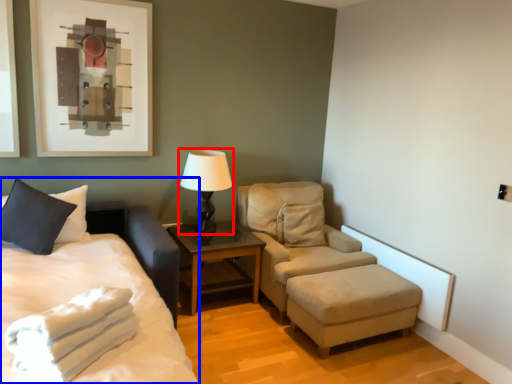
Question: Which of the following is the closest to the observer, table lamp (highlighted by a red box) or bed (highlighted by a blue box)?

Choices:
 (A) table lamp
 (B) bed

Answer: (B)